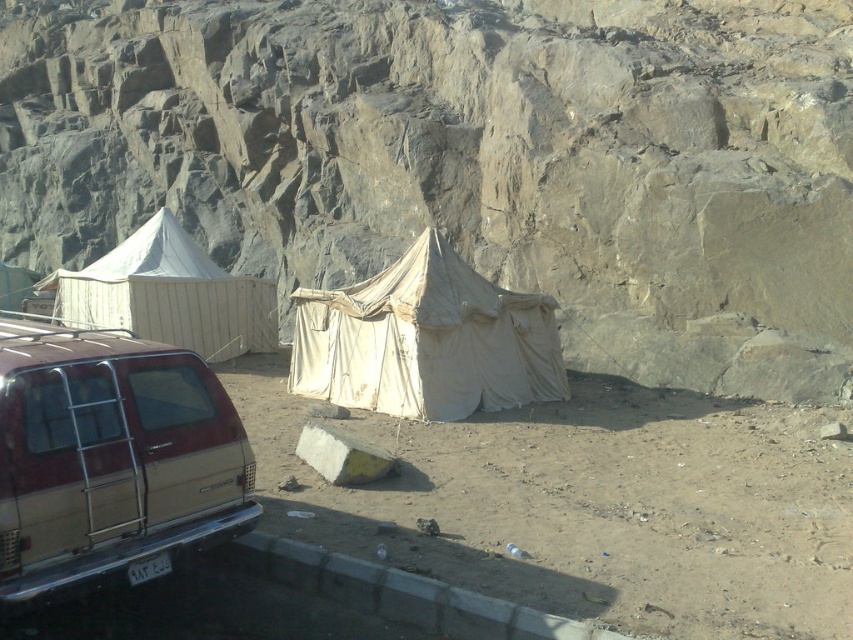
Question: Does rough stone rock face at upper center appear on the right side of white canvas tent at center?

Choices:
 (A) yes
 (B) no

Answer: (B)

Question: Based on their relative distances, which object is farther from the maroon beige minivan at lower left?

Choices:
 (A) rough stone rock face at upper center
 (B) beige canvas tent at center

Answer: (A)

Question: Considering the real-world distances, which object is closest to the white canvas tent at center?

Choices:
 (A) maroon beige minivan at lower left
 (B) beige canvas tent at center

Answer: (B)

Question: Where is rough stone rock face at upper center located in relation to white canvas tent at center in the image?

Choices:
 (A) below
 (B) above

Answer: (B)

Question: Can you confirm if maroon beige minivan at lower left is positioned below white canvas tent at center?

Choices:
 (A) no
 (B) yes

Answer: (B)

Question: Among these points, which one is farthest from the camera?

Choices:
 (A) (158, 513)
 (B) (192, 260)

Answer: (B)